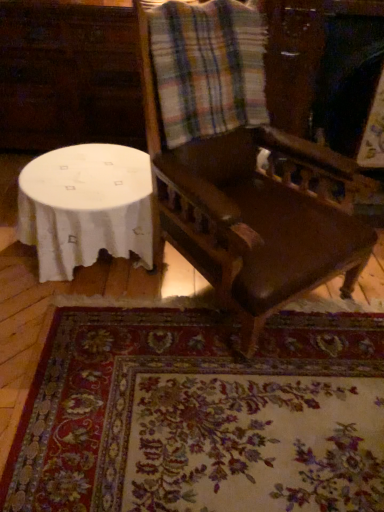
Question: Is the position of plaid fabric at upper center more distant than that of white cloth-covered table at lower left?

Choices:
 (A) no
 (B) yes

Answer: (A)

Question: Is plaid fabric at upper center closer to the viewer compared to white cloth-covered table at lower left?

Choices:
 (A) yes
 (B) no

Answer: (A)

Question: From a real-world perspective, is plaid fabric at upper center located higher than white cloth-covered table at lower left?

Choices:
 (A) no
 (B) yes

Answer: (B)

Question: Is plaid fabric at upper center at the left side of white cloth-covered table at lower left?

Choices:
 (A) no
 (B) yes

Answer: (A)

Question: From the image's perspective, is plaid fabric at upper center under white cloth-covered table at lower left?

Choices:
 (A) no
 (B) yes

Answer: (A)

Question: Is white cloth-covered table at lower left wider or thinner than floral carpet at lower center?

Choices:
 (A) wide
 (B) thin

Answer: (B)

Question: Does point (112, 186) appear closer or farther from the camera than point (135, 489)?

Choices:
 (A) farther
 (B) closer

Answer: (A)

Question: From a real-world perspective, is white cloth-covered table at lower left positioned above or below floral carpet at lower center?

Choices:
 (A) above
 (B) below

Answer: (A)

Question: In the image, is white cloth-covered table at lower left on the left side or the right side of floral carpet at lower center?

Choices:
 (A) right
 (B) left

Answer: (B)

Question: From their relative heights in the image, would you say plaid fabric at upper center is taller or shorter than dark brown wood chair at center?

Choices:
 (A) short
 (B) tall

Answer: (A)

Question: Looking at their shapes, would you say plaid fabric at upper center is wider or thinner than dark brown wood chair at center?

Choices:
 (A) wide
 (B) thin

Answer: (B)

Question: From the image's perspective, is plaid fabric at upper center located above or below dark brown wood chair at center?

Choices:
 (A) above
 (B) below

Answer: (A)

Question: Visually, is plaid fabric at upper center positioned to the left or to the right of dark brown wood chair at center?

Choices:
 (A) right
 (B) left

Answer: (B)

Question: Is point (235, 117) closer or farther from the camera than point (140, 486)?

Choices:
 (A) farther
 (B) closer

Answer: (A)

Question: From their relative heights in the image, would you say plaid fabric at upper center is taller or shorter than floral carpet at lower center?

Choices:
 (A) tall
 (B) short

Answer: (A)